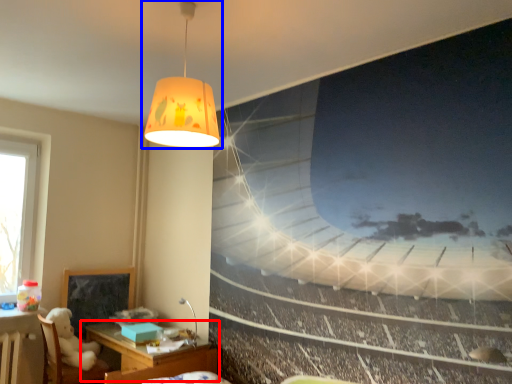
Question: Among these objects, which one is nearest to the camera, table (highlighted by a red box) or lamp (highlighted by a blue box)?

Choices:
 (A) table
 (B) lamp

Answer: (B)